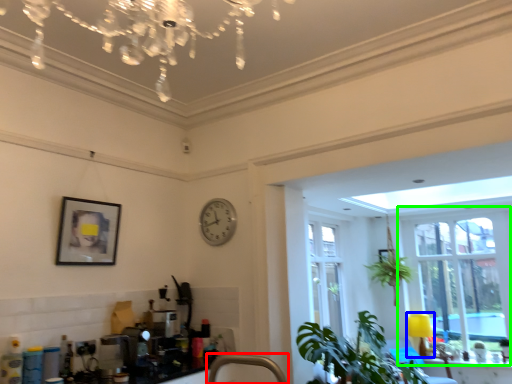
Question: Estimate the real-world distances between objects in this image. Which object is farther from faucet (highlighted by a red box), lamp (highlighted by a blue box) or window (highlighted by a green box)?

Choices:
 (A) lamp
 (B) window

Answer: (A)